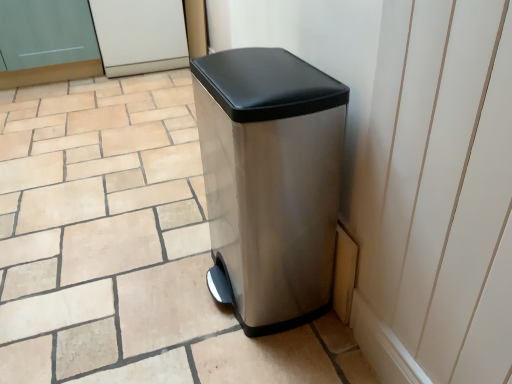
Where is `matte silver trash can at center`? matte silver trash can at center is located at coordinates (126, 248).

This screenshot has width=512, height=384. What do you see at coordinates (270, 182) in the screenshot?
I see `stainless steel trash can at center` at bounding box center [270, 182].

Identify the location of stainless steel trash can at center. Image resolution: width=512 pixels, height=384 pixels. (270, 182).

Describe the element at coordinates (45, 33) in the screenshot. Image resolution: width=512 pixels, height=384 pixels. I see `matte glass screen door at upper left, which is counted as the first screen door, starting from the left` at that location.

Locate an element on the screen. This screenshot has width=512, height=384. white glossy screen door at upper center, which ranks as the first screen door in right-to-left order is located at coordinates (140, 35).

Image resolution: width=512 pixels, height=384 pixels. Identify the location of matte silver trash can at center. (126, 248).

You are a GUI agent. You are given a task and a screenshot of the screen. Output one action in this format:
    pyautogui.click(x=<x>, y=<y>)
    Task: Click on the screen door that is the 2nd object located behind the matte silver trash can at center
    Image resolution: width=512 pixels, height=384 pixels.
    Given the screenshot: What is the action you would take?
    pyautogui.click(x=140, y=35)

Considering the positions of objects white glossy screen door at upper center, which ranks as the first screen door in right-to-left order, and matte silver trash can at center in the image provided, who is in front, white glossy screen door at upper center, which ranks as the first screen door in right-to-left order, or matte silver trash can at center?

Positioned in front is matte silver trash can at center.

Is white glossy screen door at upper center, which ranks as the first screen door in right-to-left order, completely or partially outside of matte silver trash can at center?

Absolutely, white glossy screen door at upper center, which ranks as the first screen door in right-to-left order, is external to matte silver trash can at center.

From a real-world perspective, is matte silver trash can at center under stainless steel trash can at center?

Yes.

Is stainless steel trash can at center inside matte silver trash can at center?

No, stainless steel trash can at center is not a part of matte silver trash can at center.

Does matte silver trash can at center turn towards white glossy screen door at upper center, positioned as the second screen door in left-to-right order?

No, matte silver trash can at center does not turn towards white glossy screen door at upper center, positioned as the second screen door in left-to-right order.

Can you confirm if matte silver trash can at center is thinner than white glossy screen door at upper center, positioned as the second screen door in left-to-right order?

In fact, matte silver trash can at center might be wider than white glossy screen door at upper center, positioned as the second screen door in left-to-right order.

Is point (345, 379) more distant than point (135, 38)?

No, (345, 379) is closer to viewer.

Consider the image. From the image's perspective, which object appears higher, matte silver trash can at center or white glossy screen door at upper center, which ranks as the first screen door in right-to-left order?

white glossy screen door at upper center, which ranks as the first screen door in right-to-left order, is shown above in the image.

Looking at their sizes, would you say stainless steel trash can at center is wider or thinner than matte silver trash can at center?

stainless steel trash can at center is thinner than matte silver trash can at center.

Between stainless steel trash can at center and matte silver trash can at center, which one has larger size?

With larger size is matte silver trash can at center.

Between stainless steel trash can at center and matte silver trash can at center, which one has less height?

With less height is matte silver trash can at center.

Could you tell me if stainless steel trash can at center is turned towards matte silver trash can at center?

No, stainless steel trash can at center is not facing towards matte silver trash can at center.

Is matte glass screen door at upper left, which is counted as the first screen door, starting from the left, oriented away from white glossy screen door at upper center, positioned as the second screen door in left-to-right order?

matte glass screen door at upper left, which is counted as the first screen door, starting from the left, is not turned away from white glossy screen door at upper center, positioned as the second screen door in left-to-right order.

Is the position of matte glass screen door at upper left, which is counted as the first screen door, starting from the left, less distant than that of white glossy screen door at upper center, which ranks as the first screen door in right-to-left order?

Yes, it is.

Which of these two, matte glass screen door at upper left, which is the 2th screen door in right-to-left order, or white glossy screen door at upper center, positioned as the second screen door in left-to-right order, stands taller?

Standing taller between the two is matte glass screen door at upper left, which is the 2th screen door in right-to-left order.

From the picture: Is the surface of stainless steel trash can at center in direct contact with white glossy screen door at upper center, positioned as the second screen door in left-to-right order?

No, stainless steel trash can at center is not touching white glossy screen door at upper center, positioned as the second screen door in left-to-right order.

Between stainless steel trash can at center and white glossy screen door at upper center, positioned as the second screen door in left-to-right order, which one has larger width?

A: white glossy screen door at upper center, positioned as the second screen door in left-to-right order.

Which object is further away from the camera taking this photo, stainless steel trash can at center or white glossy screen door at upper center, positioned as the second screen door in left-to-right order?

white glossy screen door at upper center, positioned as the second screen door in left-to-right order, is more distant.

Is stainless steel trash can at center facing towards white glossy screen door at upper center, positioned as the second screen door in left-to-right order?

No, stainless steel trash can at center is not aimed at white glossy screen door at upper center, positioned as the second screen door in left-to-right order.

What are the coordinates of `waste container that appears in front of the white glossy screen door at upper center, positioned as the second screen door in left-to-right order` in the screenshot? It's located at pyautogui.click(x=270, y=182).

Looking at this image, does white glossy screen door at upper center, positioned as the second screen door in left-to-right order, come behind stainless steel trash can at center?

Yes, white glossy screen door at upper center, positioned as the second screen door in left-to-right order, is further from the camera.

From their relative heights in the image, would you say white glossy screen door at upper center, which ranks as the first screen door in right-to-left order, is taller or shorter than stainless steel trash can at center?

white glossy screen door at upper center, which ranks as the first screen door in right-to-left order, is shorter than stainless steel trash can at center.

Who is smaller, white glossy screen door at upper center, positioned as the second screen door in left-to-right order, or stainless steel trash can at center?

stainless steel trash can at center.

What are the coordinates of `screen door that is the 2nd object above the matte silver trash can at center (from a real-world perspective)` in the screenshot? It's located at (140, 35).

Locate an element on the screen. tile on the left of the stainless steel trash can at center is located at coordinates (126, 248).

Based on their spatial positions, is white glossy screen door at upper center, positioned as the second screen door in left-to-right order, or stainless steel trash can at center further from matte glass screen door at upper left, which is the 2th screen door in right-to-left order?

stainless steel trash can at center is further to matte glass screen door at upper left, which is the 2th screen door in right-to-left order.

From the image, which object appears to be nearer to matte silver trash can at center, white glossy screen door at upper center, positioned as the second screen door in left-to-right order, or stainless steel trash can at center?

The object closer to matte silver trash can at center is stainless steel trash can at center.

In the scene shown: When comparing their distances from matte glass screen door at upper left, which is the 2th screen door in right-to-left order, does matte silver trash can at center or stainless steel trash can at center seem closer?

Based on the image, matte silver trash can at center appears to be nearer to matte glass screen door at upper left, which is the 2th screen door in right-to-left order.

Estimate the real-world distances between objects in this image. Which object is further from white glossy screen door at upper center, positioned as the second screen door in left-to-right order, stainless steel trash can at center or matte glass screen door at upper left, which is counted as the first screen door, starting from the left?

The object further to white glossy screen door at upper center, positioned as the second screen door in left-to-right order, is stainless steel trash can at center.

Considering their positions, is stainless steel trash can at center positioned closer to matte silver trash can at center than white glossy screen door at upper center, which ranks as the first screen door in right-to-left order?

The object closer to matte silver trash can at center is stainless steel trash can at center.

Estimate the real-world distances between objects in this image. Which object is further from matte silver trash can at center, matte glass screen door at upper left, which is the 2th screen door in right-to-left order, or white glossy screen door at upper center, which ranks as the first screen door in right-to-left order?

Based on the image, matte glass screen door at upper left, which is the 2th screen door in right-to-left order, appears to be further to matte silver trash can at center.

Based on their spatial positions, is stainless steel trash can at center or matte silver trash can at center further from matte glass screen door at upper left, which is counted as the first screen door, starting from the left?

stainless steel trash can at center.

Which object lies nearer to the anchor point white glossy screen door at upper center, which ranks as the first screen door in right-to-left order, matte silver trash can at center or stainless steel trash can at center?

The object closer to white glossy screen door at upper center, which ranks as the first screen door in right-to-left order, is matte silver trash can at center.

At what (x,y) coordinates should I click in order to perform the action: click on screen door between matte silver trash can at center and white glossy screen door at upper center, positioned as the second screen door in left-to-right order, from front to back. Please return your answer as a coordinate pair (x, y). Looking at the image, I should click on (45, 33).

Where is `waste container between matte silver trash can at center and matte glass screen door at upper left, which is the 2th screen door in right-to-left order, along the z-axis`? waste container between matte silver trash can at center and matte glass screen door at upper left, which is the 2th screen door in right-to-left order, along the z-axis is located at coordinates (270, 182).

Identify the location of screen door positioned between stainless steel trash can at center and white glossy screen door at upper center, positioned as the second screen door in left-to-right order, from near to far. point(45,33).

This screenshot has width=512, height=384. Find the location of `waste container positioned between matte silver trash can at center and white glossy screen door at upper center, which ranks as the first screen door in right-to-left order, from near to far`. waste container positioned between matte silver trash can at center and white glossy screen door at upper center, which ranks as the first screen door in right-to-left order, from near to far is located at coordinates (270, 182).